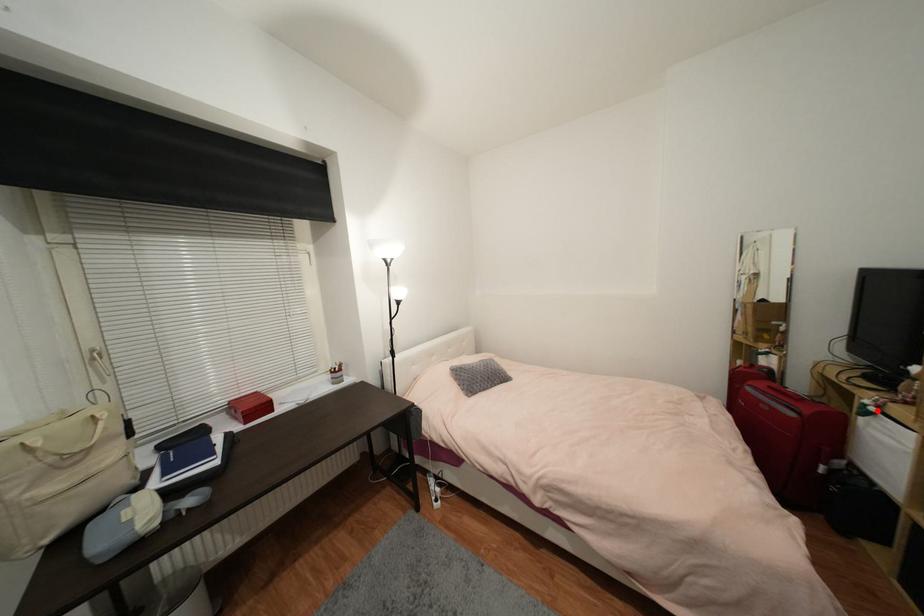
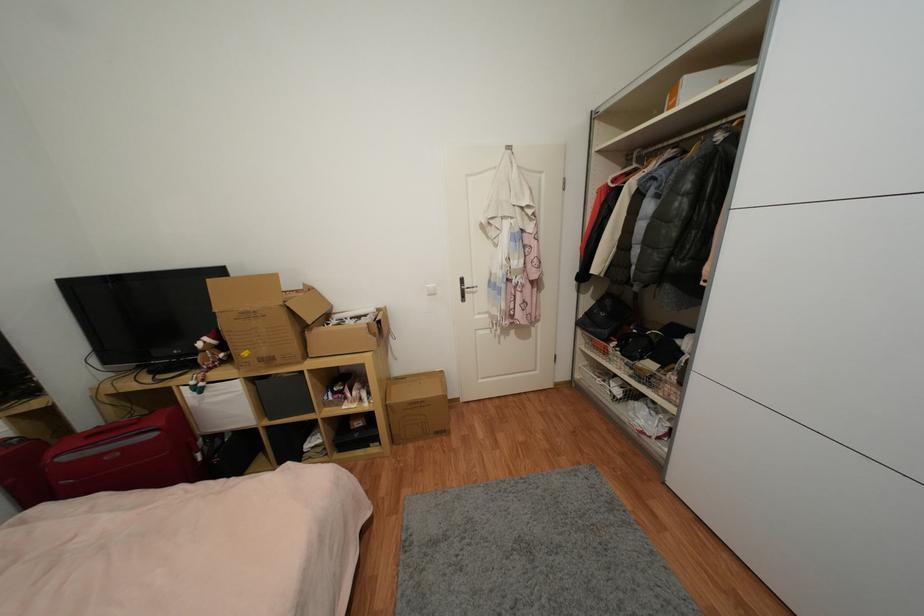
Locate, in the second image, the point that corresponds to the highlighted location in the first image.

(205, 386)